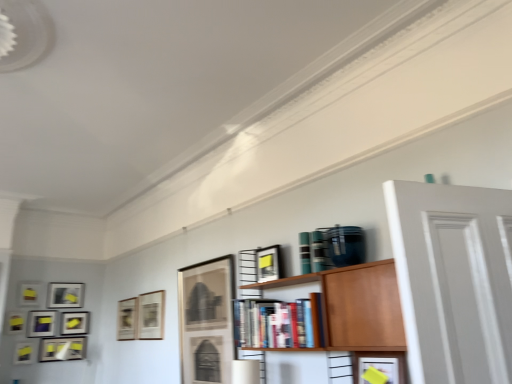
Question: Is matte black picture frame at upper left, the tenth picture frame when ordered from right to left, taller or shorter than hardcover books at center?

Choices:
 (A) short
 (B) tall

Answer: (A)

Question: Does point (24, 296) appear closer or farther from the camera than point (306, 344)?

Choices:
 (A) farther
 (B) closer

Answer: (A)

Question: Considering the real-world distances, which object is farthest from the matte black picture frame at lower left, which ranks as the 1th picture frame in left-to-right order?

Choices:
 (A) matte glass picture frame at center, which ranks as the tenth picture frame in left-to-right order
 (B) matte black picture frame at center, marked as the fourth picture frame in a right-to-left arrangement
 (C) matte black picture frame at upper left, the tenth picture frame when ordered from right to left
 (D) matte black picture frame at left, which appears as the fifth picture frame when viewed from the right
 (E) wooden bookshelf at center

Answer: (E)

Question: Estimate the real-world distances between objects in this image. Which object is closer to the matte black picture frame at center, which ranks as the eleventh picture frame in left-to-right order?

Choices:
 (A) matte black picture frame at center, which is the 3th picture frame from right to left
 (B) matte black picture frame at lower left, which ranks as the 1th picture frame in left-to-right order
 (C) matte black picture frame at lower left, placed as the 6th picture frame when sorted from right to left
 (D) hardcover books at center
 (E) matte black picture frame at left, positioned as the seventh picture frame in right-to-left order

Answer: (D)